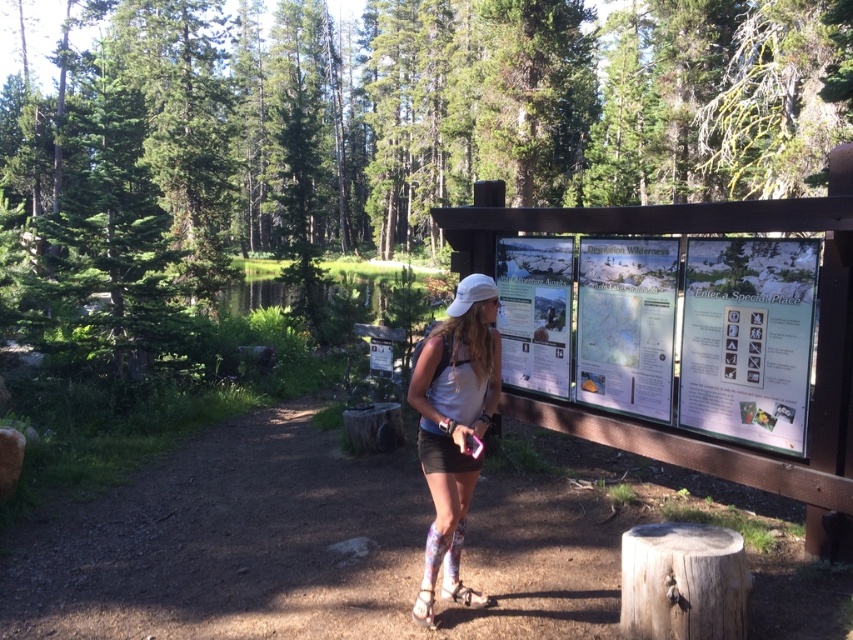
You are a hiker standing on the dirt path in the forest. You notice a point marked at coordinates (454, 429). Where exactly is this point located in relation to the woman?

The point marked at coordinates (454, 429) is located on the white matte shorts at center.

You are a photographer trying to capture the woman standing on the dirt path. You notice the white matte shorts at center and the wooden stump at lower right. Which object is closer to the camera based on their positions?

The white matte shorts at center is positioned over wooden stump at lower right, meaning it is closer to the camera.